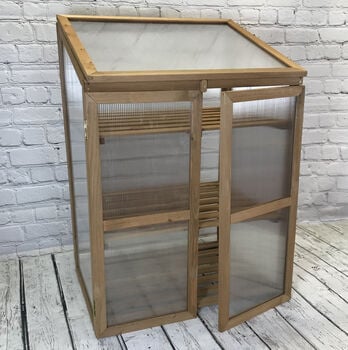
The width and height of the screenshot is (348, 350). What are the coordinates of `cabinet top` in the screenshot? It's located at (168, 40).